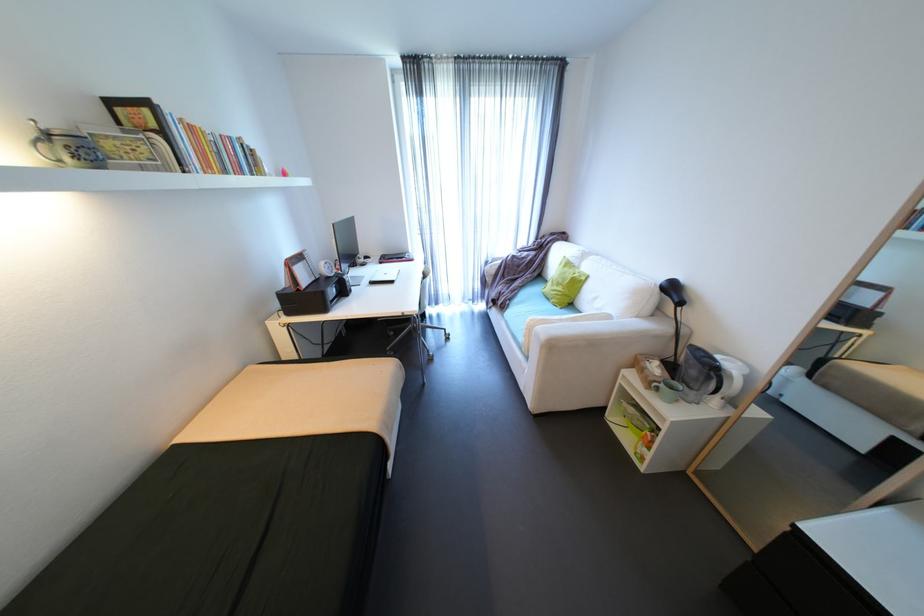
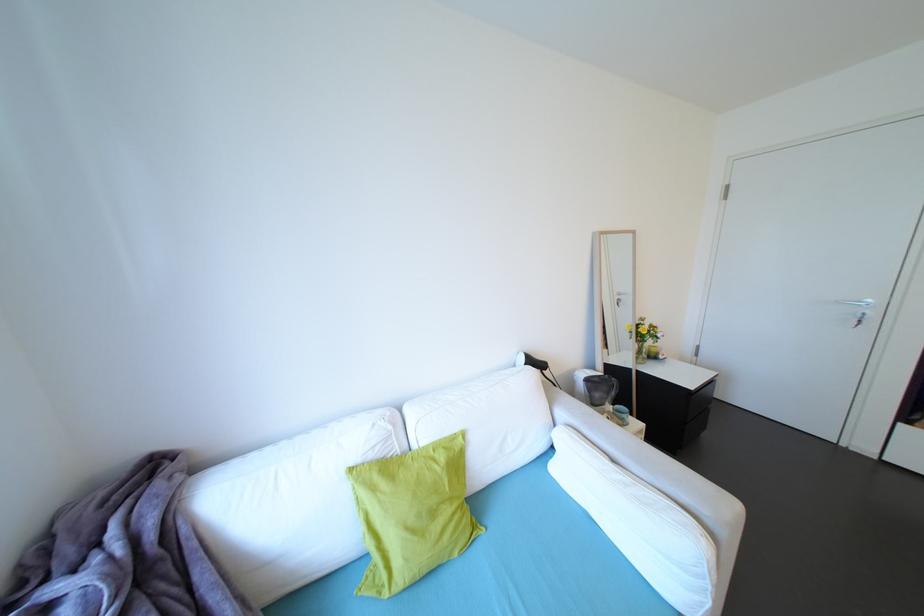
Locate, in the second image, the point that corresponds to [588,275] in the first image.

(451, 448)